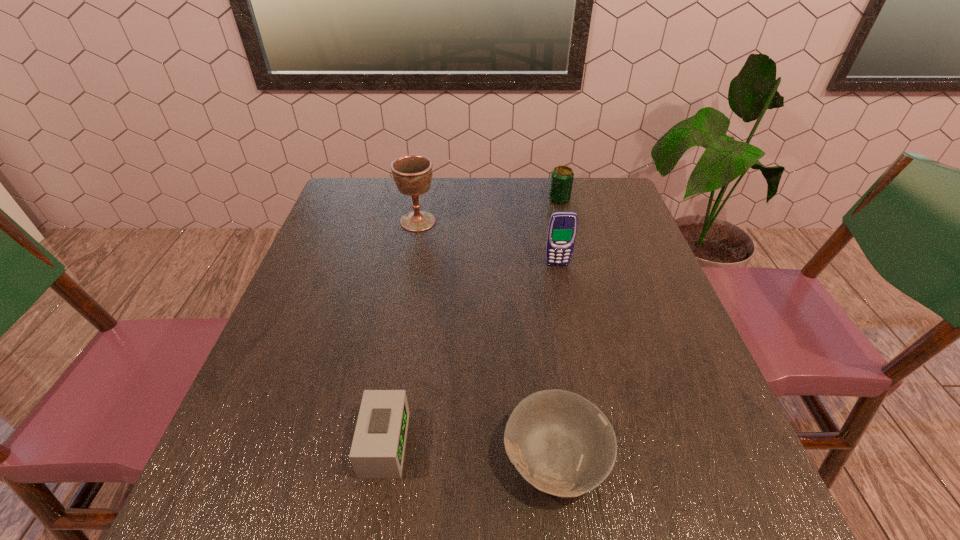
At what (x,y) coordinates should I click in order to perform the action: click on unoccupied position between the alarm clock and the fourth nearest object. Please return your answer as a coordinate pair (x, y). This screenshot has height=540, width=960. Looking at the image, I should click on (401, 333).

Where is `unoccupied position between the bowl and the alarm clock`? The image size is (960, 540). unoccupied position between the bowl and the alarm clock is located at coordinates (470, 451).

Where is `free point between the alarm clock and the cellular telephone`? free point between the alarm clock and the cellular telephone is located at coordinates (470, 355).

Locate an element on the screen. This screenshot has height=540, width=960. empty location between the third shortest object and the alarm clock is located at coordinates (471, 322).

This screenshot has height=540, width=960. Find the location of `vacant space in between the alarm clock and the third farthest object`. vacant space in between the alarm clock and the third farthest object is located at coordinates (470, 355).

In order to click on free space between the cellular telephone and the second farthest object in this screenshot , I will do `click(488, 243)`.

The width and height of the screenshot is (960, 540). In order to click on vacant space that is in between the second farthest object and the cellular telephone in this screenshot , I will do click(488, 243).

At what (x,y) coordinates should I click in order to perform the action: click on blank region between the beer can and the second farthest object. Please return your answer as a coordinate pair (x, y). The width and height of the screenshot is (960, 540). Looking at the image, I should click on (489, 211).

Identify the location of vacant area that lies between the second farthest object and the cellular telephone. The image size is (960, 540). (488, 243).

At what (x,y) coordinates should I click in order to perform the action: click on vacant space that's between the second farthest object and the bowl. Please return your answer as a coordinate pair (x, y). The image size is (960, 540). Looking at the image, I should click on (487, 339).